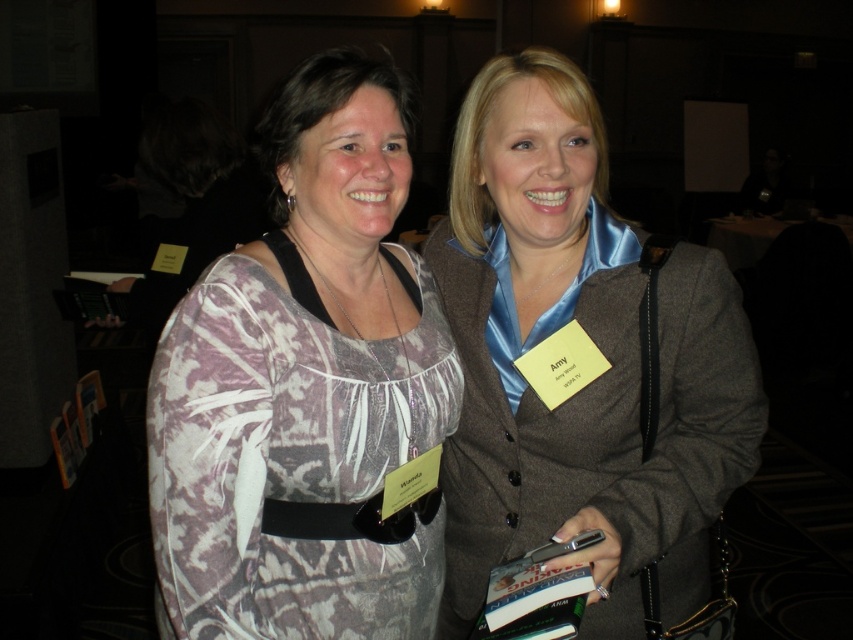
You are a photographer taking a picture of two women at an event. You need to focus on the woman closer to the camera. Which point, point (364, 381) or point (564, 476), should you focus on?

You should focus on point (364, 381) because it is closer to the viewer than point (564, 476).

You are organizing a photoshoot and need to position a light source to the left of the printed fabric dress at center. Based on the scene description, where should you place the light source relative to the dress?

The printed fabric dress at center is located at point [305,388]. To place the light source to the left of the dress, position it to the left side of the printed fabric dress at center.